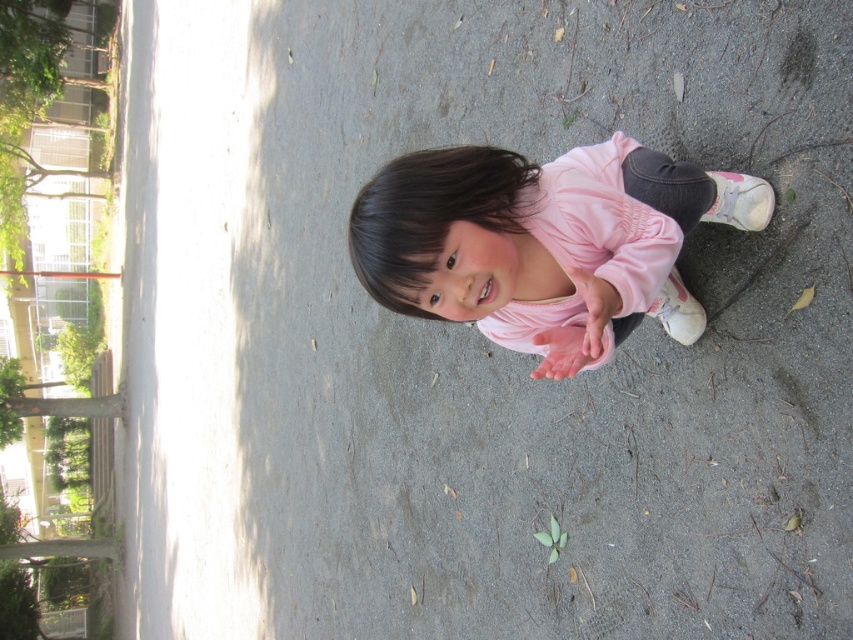
In the scene shown: You are a fashion designer observing a child wearing two pink items at the center of the image. Which item has a larger size between the pink matte shirt at center and the pink matte dress at center?

The pink matte shirt at center is bigger than the pink matte dress at center.

You are a photographer trying to capture a clear shot of the child in the scene. The pink matte shirt at center and the pink matte dress at center are both in the frame. Which clothing item should you focus on to ensure the child is in focus?

The pink matte shirt at center is in front of the pink matte dress at center, so focusing on the pink matte shirt at center will ensure the child is in focus.

You are a photographer trying to capture a clear shot of the child in the scene. The pink matte shirt at center and the pink matte dress at center are both visible. Which one should you focus on if you want to ensure the item closer to the camera is in focus?

The pink matte shirt at center is positioned under the pink matte dress at center, meaning the shirt is closer to the camera. Therefore, focusing on the pink matte shirt at center will ensure the closer item is in focus.